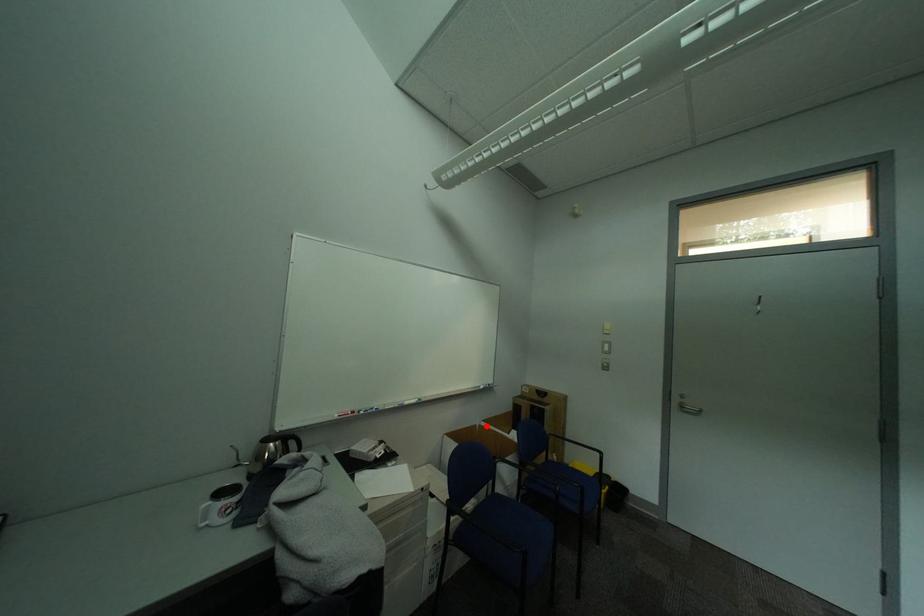
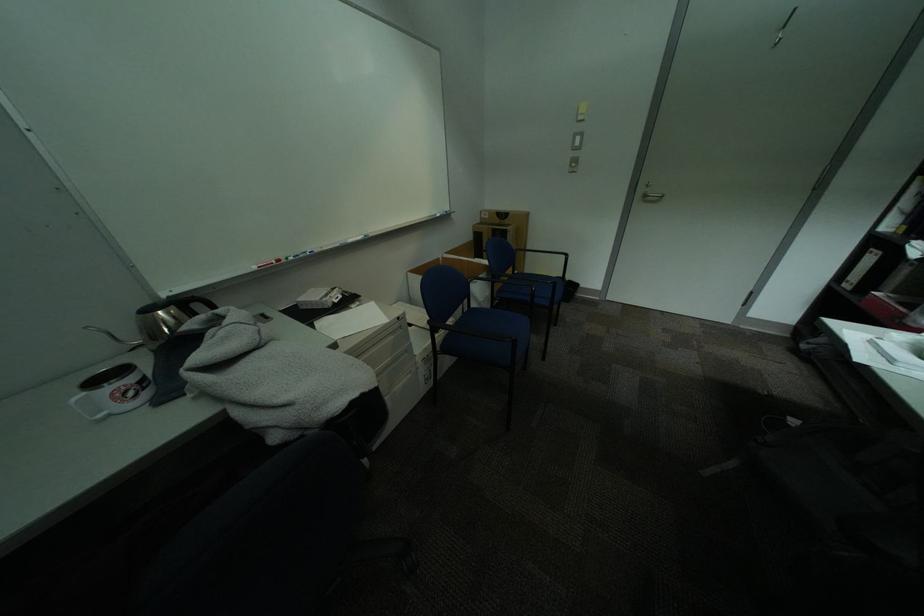
Where in the second image is the point corresponding to the highlighted location from the first image?

(450, 259)